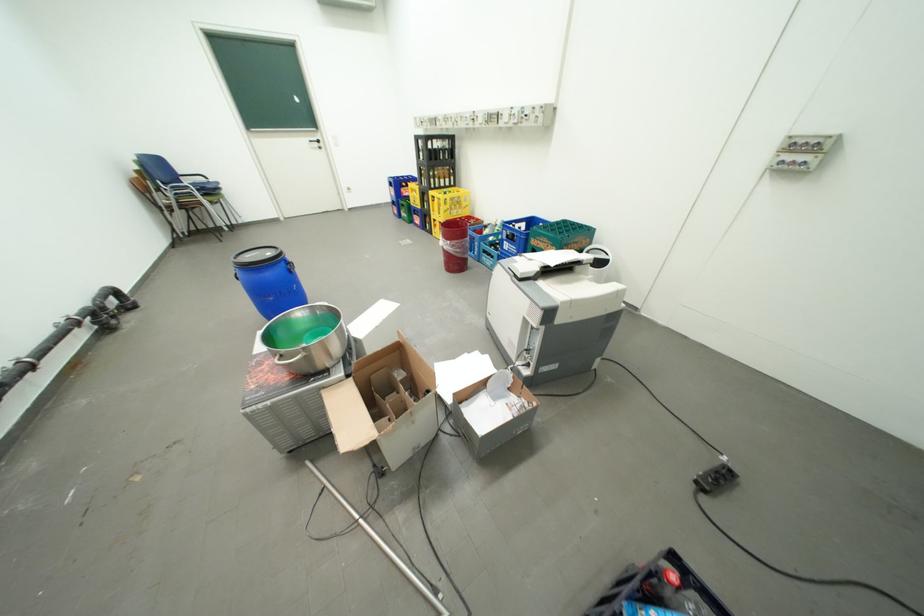
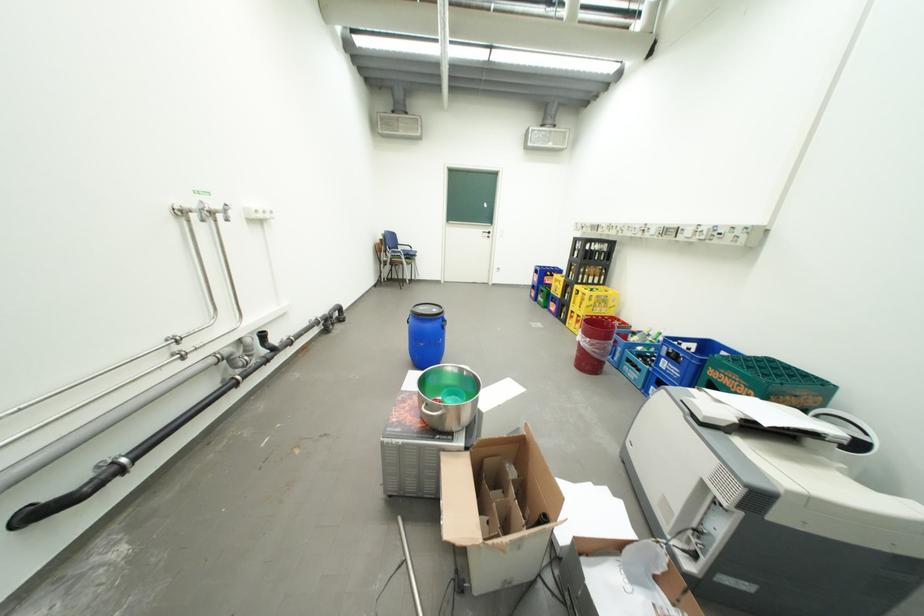
Find the pixel in the second image that matches point (451, 217) in the first image.

(590, 312)